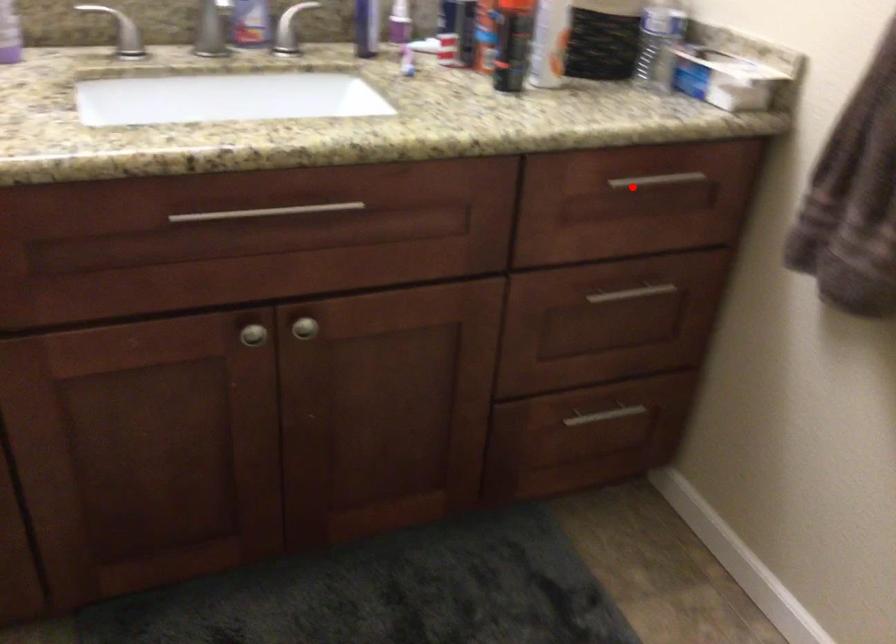
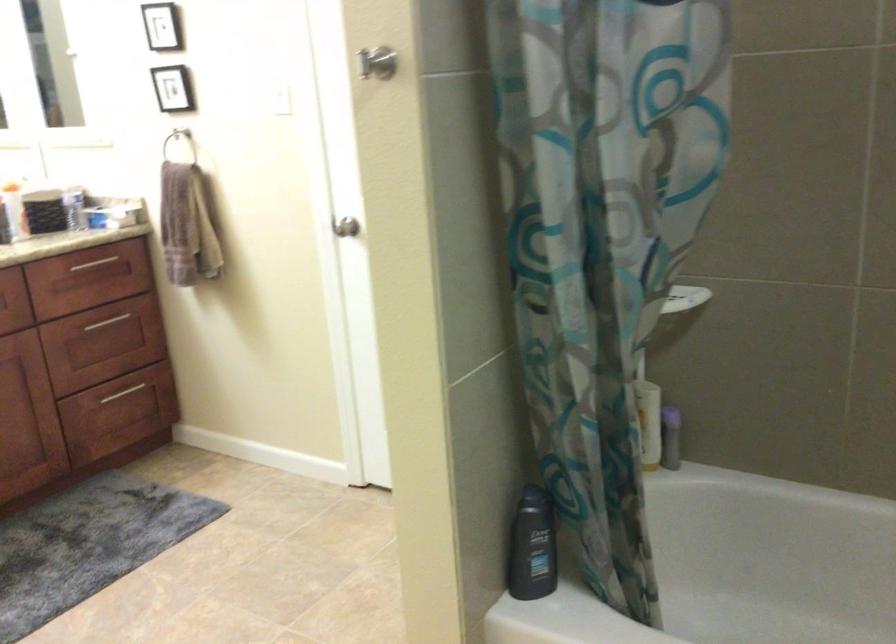
In the second image, find the point that corresponds to the highlighted location in the first image.

(92, 263)